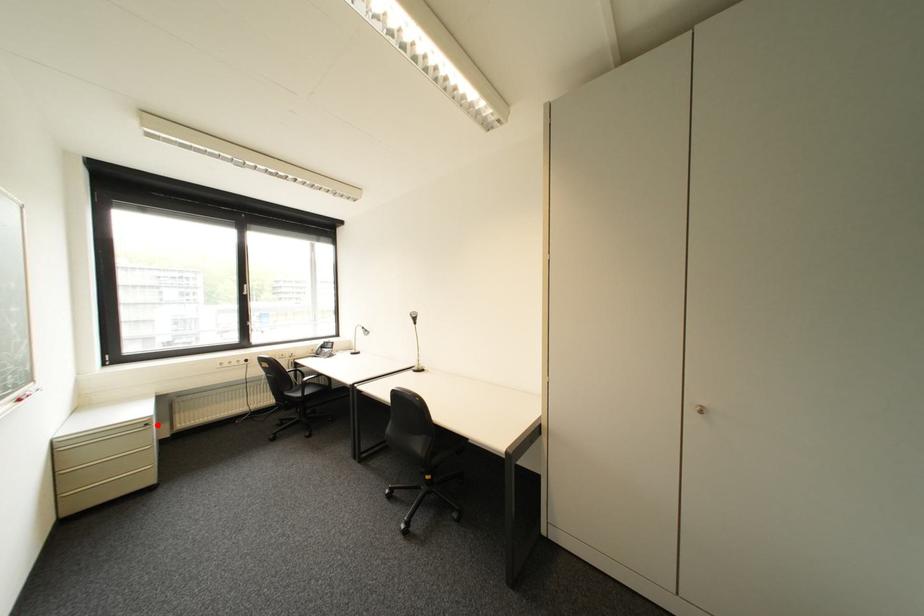
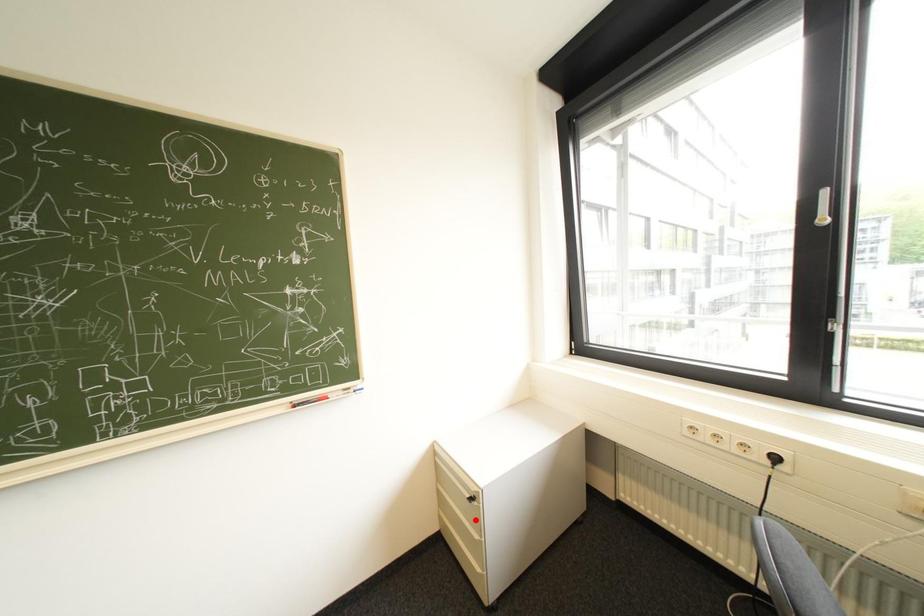
I am providing you with two images of the same scene from different viewpoints. A red point is marked on the first image and another point is marked on the second image. Are the points marked in image1 and image2 representing the same 3D position?

No